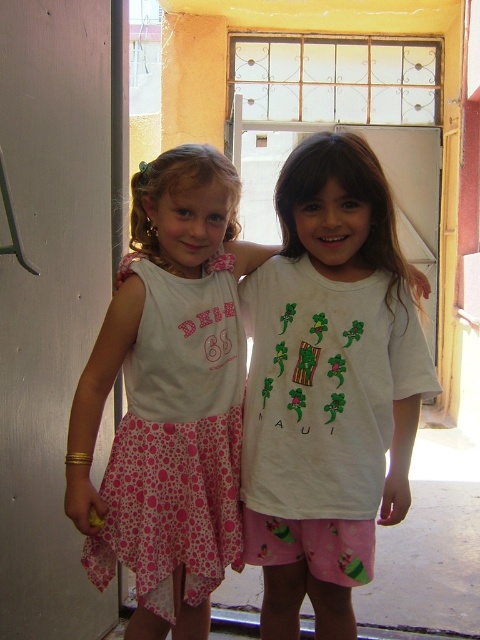
Question: Which object appears farthest from the camera in this image?

Choices:
 (A) white cotton shirt at center
 (B) pink dotted fabric dress at left
 (C) white matte door at left

Answer: (B)

Question: Does white matte door at left have a lesser width compared to pink dotted fabric dress at left?

Choices:
 (A) yes
 (B) no

Answer: (A)

Question: Among these objects, which one is nearest to the camera?

Choices:
 (A) pink dotted fabric dress at left
 (B) white cotton shirt at center

Answer: (B)

Question: In this image, where is white matte door at left located relative to white cotton shirt at center?

Choices:
 (A) above
 (B) below

Answer: (A)

Question: Which object is the closest to the white cotton shirt at center?

Choices:
 (A) pink dotted fabric dress at left
 (B) white matte door at left

Answer: (A)

Question: Considering the relative positions of white cotton shirt at center and pink dotted fabric dress at left in the image provided, where is white cotton shirt at center located with respect to pink dotted fabric dress at left?

Choices:
 (A) below
 (B) above

Answer: (B)